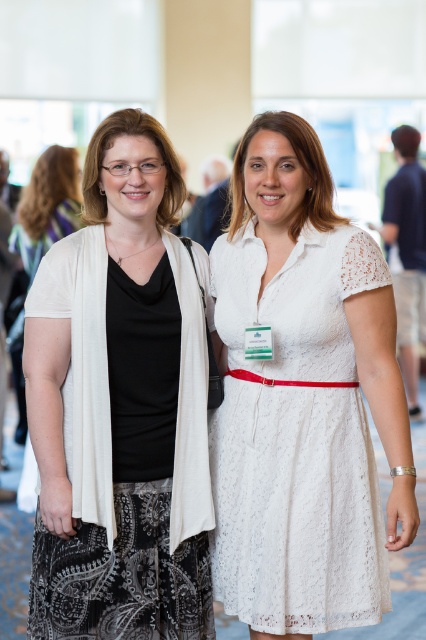
You are organizing a photo shoot and need to place a decorative banner between the matte black top at left and the white lace dress at center. Based on their widths, which object should the banner be closer to?

The matte black top at left might be wider than the white lace dress at center, so the banner should be placed closer to the white lace dress at center to ensure proper spacing between them.

You are organizing a clothing donation drive and need to determine which items are suitable for adults. You have two items to assess from the image provided. Based on their sizes, which of the two items, the matte black top at left or the white lace dress at center, is more likely to be adult size?

The matte black top at left is larger in size than the white lace dress at center, so it is more likely to be adult size.